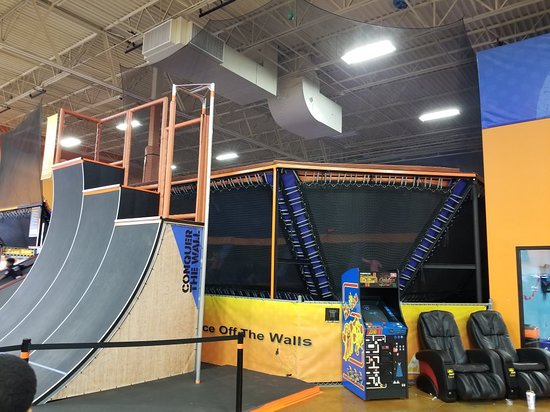
Image resolution: width=550 pixels, height=412 pixels. I want to click on arcade machine, so click(x=360, y=344).